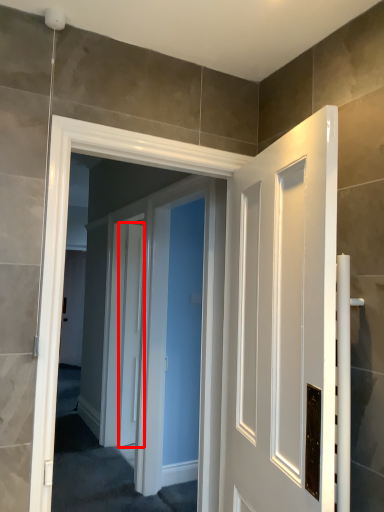
Question: From the image's perspective, where is door (annotated by the red box) located in relation to screen door in the image?

Choices:
 (A) above
 (B) below

Answer: (B)